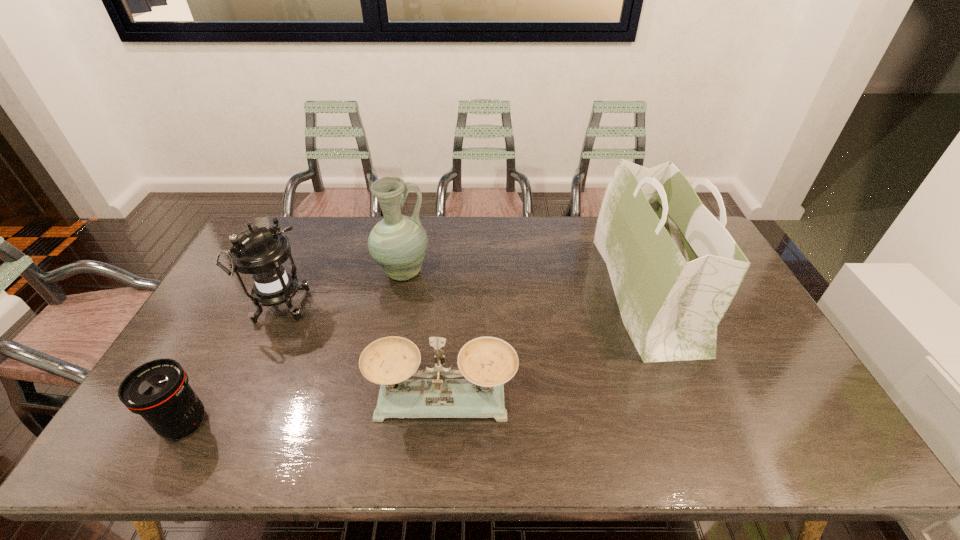
At what (x,y) coordinates should I click in order to perform the action: click on object that is the third closest to the second shortest object. Please return your answer as a coordinate pair (x, y). Looking at the image, I should click on (398, 243).

Where is `free space in the image that satisfies the following two spatial constraints: 1. on the back side of the rightmost object; 2. on the handle side of the pitcher`? This screenshot has height=540, width=960. free space in the image that satisfies the following two spatial constraints: 1. on the back side of the rightmost object; 2. on the handle side of the pitcher is located at coordinates (638, 273).

Locate an element on the screen. Image resolution: width=960 pixels, height=540 pixels. free space that satisfies the following two spatial constraints: 1. on the back side of the shortest object; 2. on the right side of the rightmost object is located at coordinates (255, 292).

Identify the location of free space in the image that satisfies the following two spatial constraints: 1. on the back side of the rightmost object; 2. on the left side of the lantern. Image resolution: width=960 pixels, height=540 pixels. (287, 292).